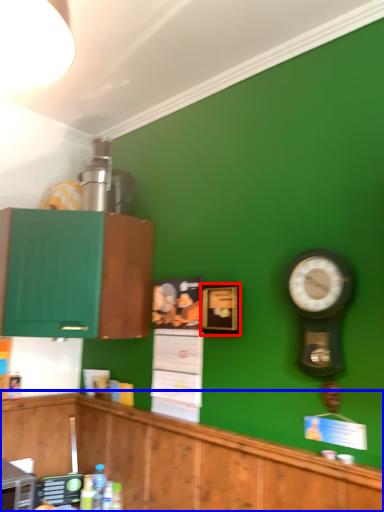
Question: Which object appears farthest to the camera in this image, picture frame (highlighted by a red box) or cabinetry (highlighted by a blue box)?

Choices:
 (A) picture frame
 (B) cabinetry

Answer: (A)